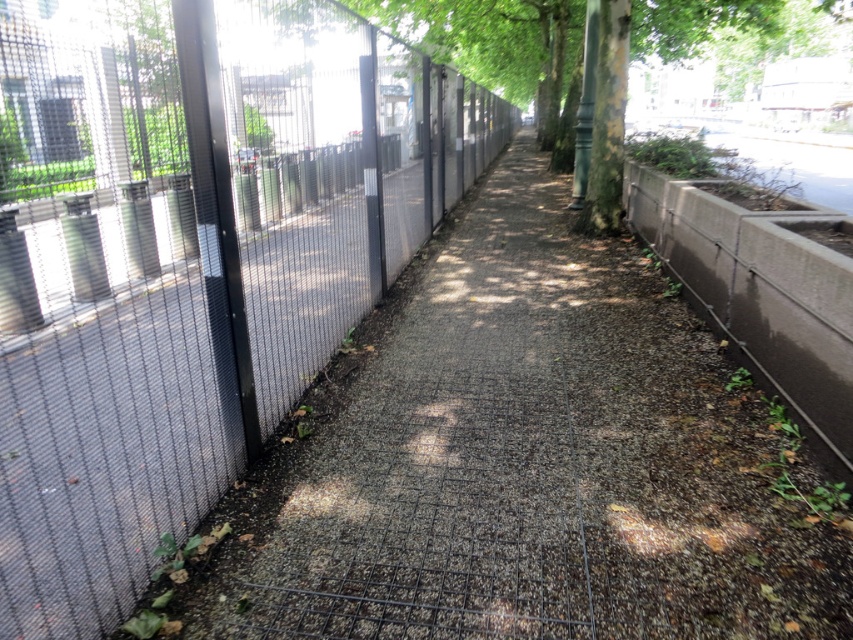
Question: In this image, where is metal mesh fence at left located relative to green textured tree at center?

Choices:
 (A) below
 (B) above

Answer: (A)

Question: Which point is farther to the camera?

Choices:
 (A) green textured tree at center
 (B) metal mesh fence at left
 (C) gray gravel pavement at center

Answer: (A)

Question: Which object is the closest to the green textured tree at center?

Choices:
 (A) metal mesh fence at left
 (B) gray gravel pavement at center

Answer: (A)

Question: Does metal mesh fence at left come behind gray gravel pavement at center?

Choices:
 (A) yes
 (B) no

Answer: (B)

Question: Is metal mesh fence at left thinner than green textured tree at center?

Choices:
 (A) yes
 (B) no

Answer: (A)

Question: Which point appears farthest from the camera in this image?

Choices:
 (A) (300, 548)
 (B) (561, 48)

Answer: (B)